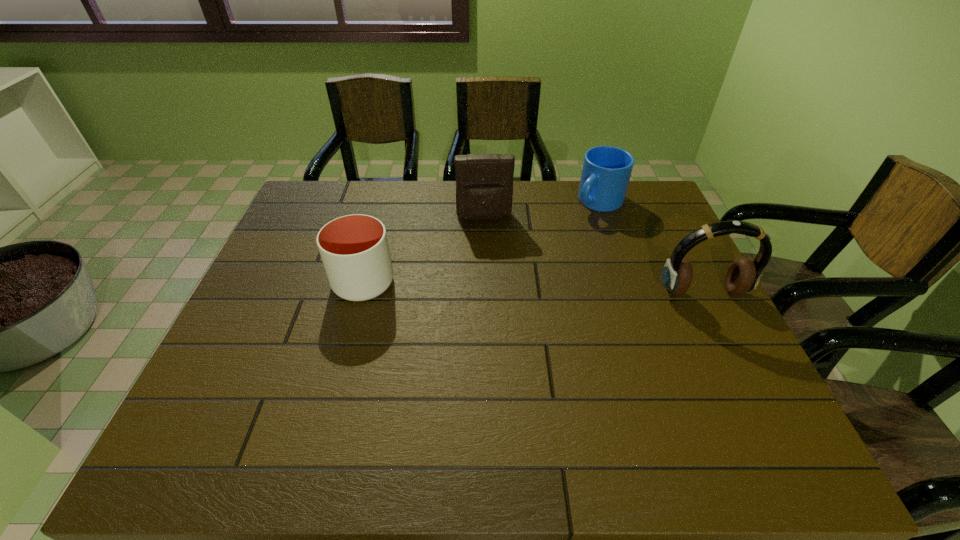
Find the location of a particular element. vacant space at the far right corner of the desktop is located at coordinates (659, 218).

Identify the location of blank region between the mug and the pouch. (x=541, y=210).

Locate an element on the screen. The width and height of the screenshot is (960, 540). vacant area that lies between the mug and the cup is located at coordinates (481, 242).

Where is `free spot between the headset and the third object from right to left`? free spot between the headset and the third object from right to left is located at coordinates (593, 255).

At what (x,y) coordinates should I click in order to perform the action: click on free space between the pouch and the cup. Please return your answer as a coordinate pair (x, y). Looking at the image, I should click on (423, 250).

The height and width of the screenshot is (540, 960). Find the location of `vacant area that lies between the second object from left to right and the mug`. vacant area that lies between the second object from left to right and the mug is located at coordinates coord(541,210).

Locate an element on the screen. vacant region between the mug and the third object from right to left is located at coordinates (541, 210).

Locate an element on the screen. vacant space that is in between the headset and the mug is located at coordinates (651, 247).

You are a GUI agent. You are given a task and a screenshot of the screen. Output one action in this format:
    pyautogui.click(x=<x>, y=<y>)
    Task: Click on the unoccupied area between the mug and the headset
    Image resolution: width=960 pixels, height=540 pixels.
    Given the screenshot: What is the action you would take?
    pyautogui.click(x=651, y=247)

You are a GUI agent. You are given a task and a screenshot of the screen. Output one action in this format:
    pyautogui.click(x=<x>, y=<y>)
    Task: Click on the free space between the mug and the third object from right to left
    The width and height of the screenshot is (960, 540).
    Given the screenshot: What is the action you would take?
    pyautogui.click(x=541, y=210)